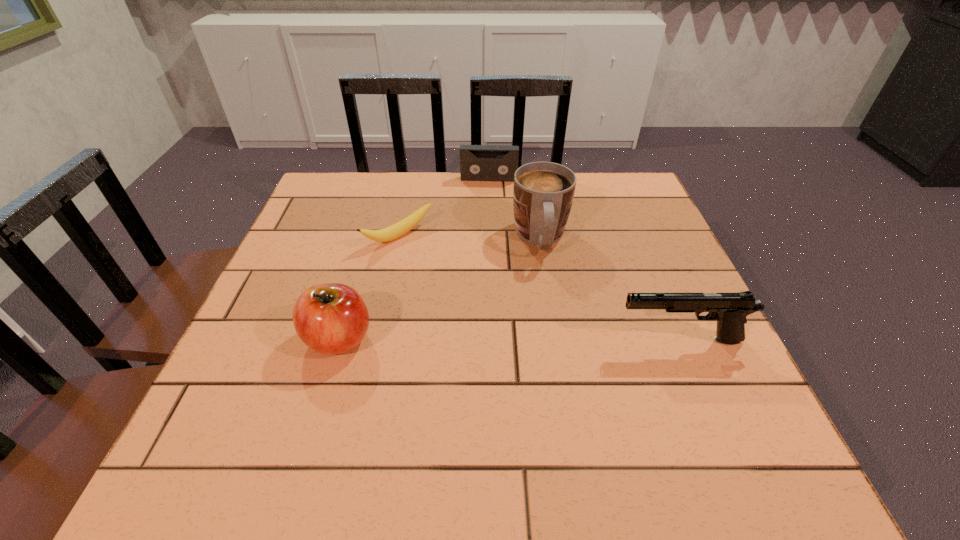
The height and width of the screenshot is (540, 960). I want to click on apple, so click(331, 318).

Image resolution: width=960 pixels, height=540 pixels. I want to click on gun, so click(x=730, y=310).

Where is `the shortest object`? This screenshot has width=960, height=540. the shortest object is located at coordinates (390, 233).

Find the location of a particular element. the farthest object is located at coordinates (477, 162).

Identify the location of the second shortest object. This screenshot has height=540, width=960. (477, 162).

This screenshot has width=960, height=540. In order to click on mug in this screenshot , I will do `click(543, 192)`.

I want to click on blank space located 0.400m on the back of the apple, so click(378, 205).

Where is `free space located 0.400m at the aiming end of the rightmost object`? The height and width of the screenshot is (540, 960). free space located 0.400m at the aiming end of the rightmost object is located at coordinates (411, 340).

What are the coordinates of `free spot located 0.260m at the aiming end of the rightmost object` in the screenshot? It's located at (483, 340).

Where is `vacant area located at the aiming end of the rightmost object`? vacant area located at the aiming end of the rightmost object is located at coordinates (492, 340).